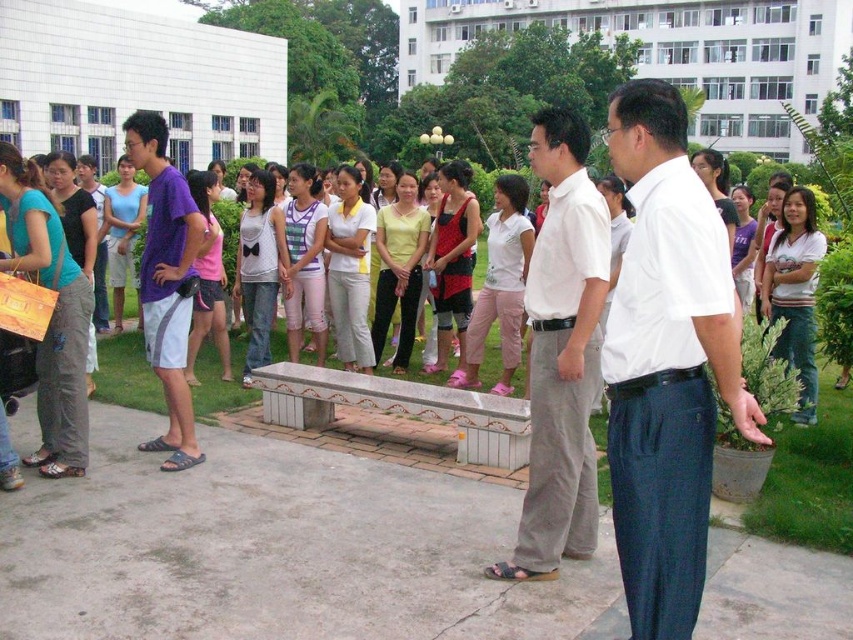
Question: Which of the following is the closest to the observer?

Choices:
 (A) (164, 385)
 (B) (579, 480)
 (C) (809, 323)
 (D) (686, 490)

Answer: (D)

Question: Does white cotton shirt at center appear on the left side of white striped shirt at center?

Choices:
 (A) yes
 (B) no

Answer: (A)

Question: Is white smooth shirt at center closer to camera compared to white cotton shirt at center?

Choices:
 (A) yes
 (B) no

Answer: (A)

Question: Which object appears farthest from the camera in this image?

Choices:
 (A) purple fabric shorts at left
 (B) white smooth shirt at center
 (C) white cotton shirt at center

Answer: (A)

Question: Does white smooth shirt at center lie behind white cotton shirt at center?

Choices:
 (A) no
 (B) yes

Answer: (A)

Question: Which of the following is the farthest from the observer?

Choices:
 (A) purple fabric shorts at left
 (B) white smooth shirt at center
 (C) white cotton shirt at center
 (D) white striped shirt at center

Answer: (D)